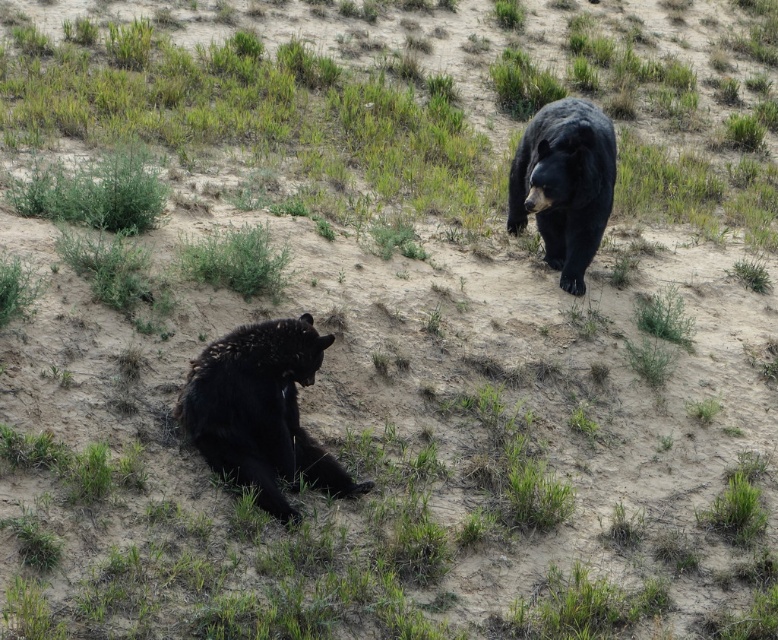
Question: Considering the relative positions of shiny black bear at lower left and shiny black bear at upper right in the image provided, where is shiny black bear at lower left located with respect to shiny black bear at upper right?

Choices:
 (A) below
 (B) above

Answer: (A)

Question: Can you confirm if shiny black bear at lower left is smaller than shiny black bear at upper right?

Choices:
 (A) no
 (B) yes

Answer: (B)

Question: Is shiny black bear at lower left bigger than shiny black bear at upper right?

Choices:
 (A) yes
 (B) no

Answer: (B)

Question: Which of the following is the closest to the observer?

Choices:
 (A) (177, 400)
 (B) (596, 195)

Answer: (A)